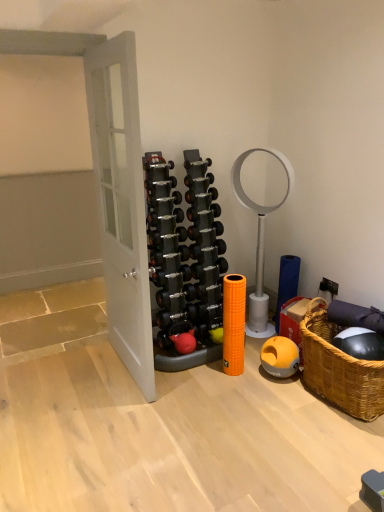
Identify the location of vacant space to the left of white matte door at left. Image resolution: width=384 pixels, height=512 pixels. (64, 387).